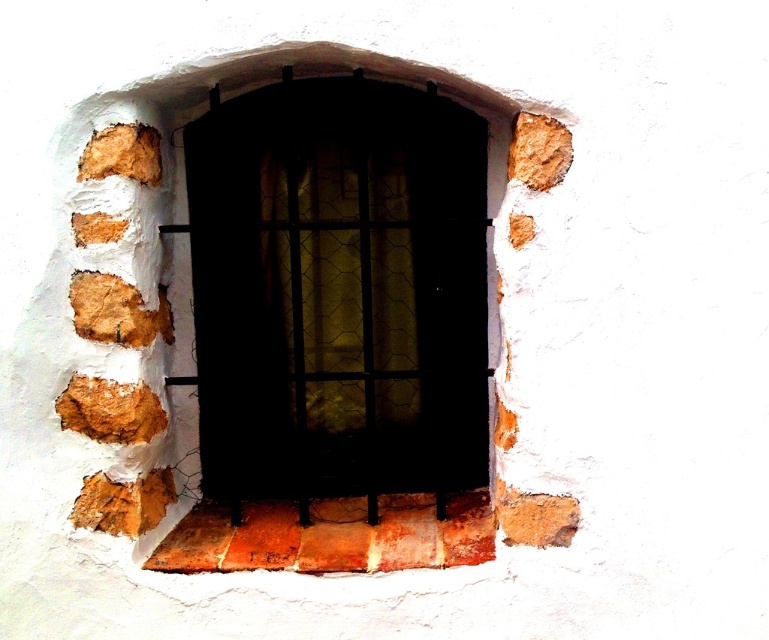
Question: Can you confirm if matte black window at center is positioned to the left of rusty brick at center?

Choices:
 (A) yes
 (B) no

Answer: (B)

Question: Which object is closer to the camera taking this photo?

Choices:
 (A) rusty brick at center
 (B) matte black window at center

Answer: (B)

Question: Which point is closer to the camera taking this photo?

Choices:
 (A) (168, 548)
 (B) (371, 424)

Answer: (A)

Question: Is matte black window at center positioned before rusty brick at center?

Choices:
 (A) yes
 (B) no

Answer: (A)

Question: Which of the following is the farthest from the observer?

Choices:
 (A) (x=265, y=474)
 (B) (x=208, y=516)

Answer: (A)

Question: Does matte black window at center appear on the left side of rusty brick at center?

Choices:
 (A) no
 (B) yes

Answer: (A)